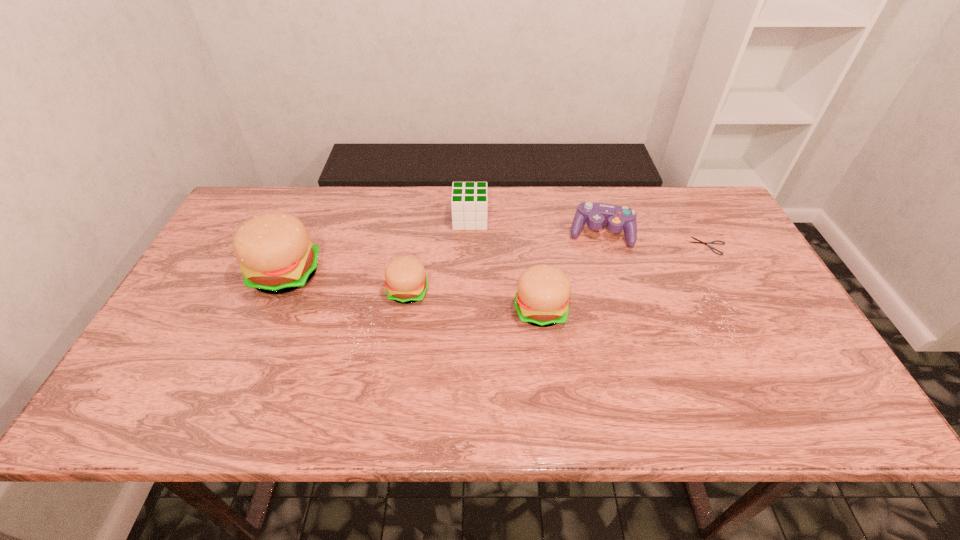
Where is `vacant area situated on the right of the tallest object`? Image resolution: width=960 pixels, height=540 pixels. vacant area situated on the right of the tallest object is located at coordinates (340, 274).

The height and width of the screenshot is (540, 960). I want to click on vacant space located 0.090m on the back of the shortest hamburger, so click(414, 253).

Locate an element on the screen. Image resolution: width=960 pixels, height=540 pixels. blank space located 0.330m on the right of the fourth object from left to right is located at coordinates (698, 310).

Find the location of `free space located on the front of the rightmost object`. free space located on the front of the rightmost object is located at coordinates (766, 353).

What are the coordinates of `blank space located on the left of the control` in the screenshot? It's located at (458, 233).

Find the location of a particular element. This screenshot has width=960, height=540. vacant space situated on the red face of the cube is located at coordinates (585, 220).

At what (x,y) coordinates should I click in order to perform the action: click on control positioned at the far edge. Please return your answer as a coordinate pair (x, y). The height and width of the screenshot is (540, 960). Looking at the image, I should click on (615, 218).

Where is `cube positioned at the far edge`? cube positioned at the far edge is located at coordinates (469, 203).

Where is `object positioned at the left edge`? object positioned at the left edge is located at coordinates point(276,255).

Identify the location of object at the right edge. The width and height of the screenshot is (960, 540). (701, 242).